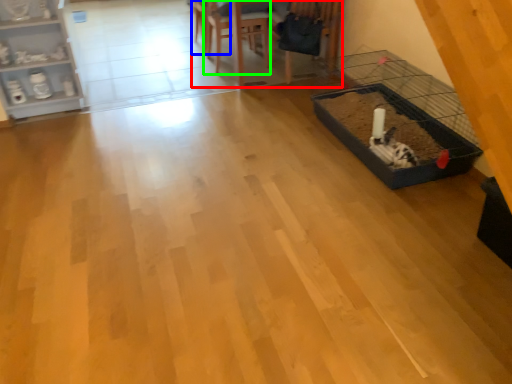
Question: Which object is the farthest from table (highlighted by a red box)? Choose among these: armchair (highlighted by a blue box) or armchair (highlighted by a green box).

Choices:
 (A) armchair
 (B) armchair

Answer: (A)